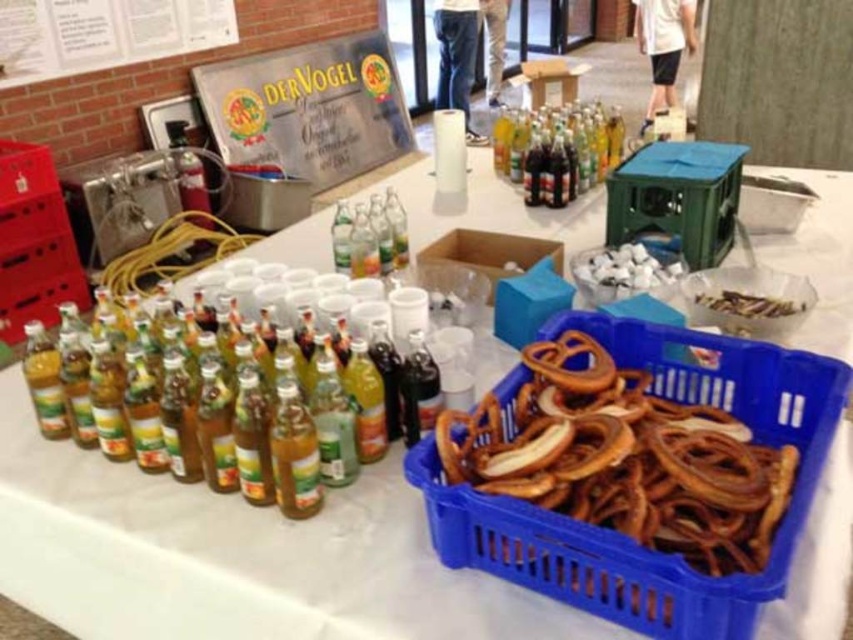
Is blue plastic basket at lower right shorter than dark glass bottle at center?

No, blue plastic basket at lower right is not shorter than dark glass bottle at center.

Does blue plastic basket at lower right appear on the left side of dark glass bottle at center?

In fact, blue plastic basket at lower right is to the right of dark glass bottle at center.

Who is more forward, (x=820, y=369) or (x=415, y=416)?

Positioned in front is point (x=820, y=369).

In order to click on blue plastic basket at lower right in this screenshot , I will do `click(656, 552)`.

How much distance is there between metallic signboard at upper center and white cotton balls at center?

The distance of metallic signboard at upper center from white cotton balls at center is 3.44 meters.

Which is more to the left, metallic signboard at upper center or white cotton balls at center?

metallic signboard at upper center

Where is `metallic signboard at upper center`? metallic signboard at upper center is located at coordinates (309, 108).

Consider the image. Which of these two, translucent glass bottles at left or dark glass bottle at center, stands taller?

translucent glass bottles at left

Is translucent glass bottles at left to the left of dark glass bottle at center from the viewer's perspective?

Indeed, translucent glass bottles at left is positioned on the left side of dark glass bottle at center.

Does point (363, 412) lie in front of point (424, 384)?

Yes, point (363, 412) is in front of point (424, 384).

Find the location of `translucent glass bottles at left`. translucent glass bottles at left is located at coordinates (296, 429).